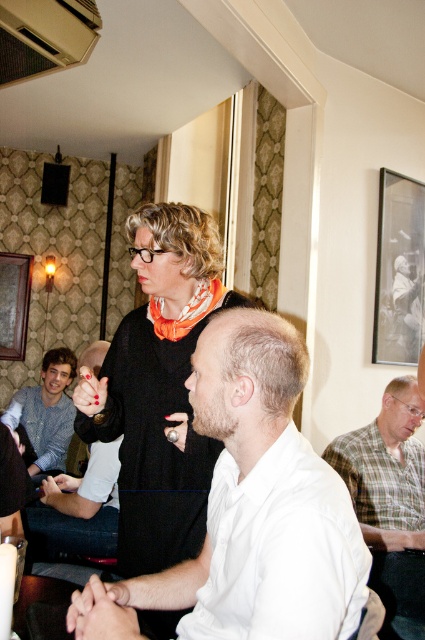
Question: Estimate the real-world distances between objects in this image. Which object is farther from the knitted sweater at left?

Choices:
 (A) white matte shirt at center
 (B) black matte picture frame at upper right
 (C) wooden picture frame at left
 (D) plaid shirt at center

Answer: (A)

Question: Estimate the real-world distances between objects in this image. Which object is farther from the white matte shirt at center?

Choices:
 (A) plaid shirt at center
 (B) black matte picture frame at upper right
 (C) white shirt at center

Answer: (B)

Question: Can you confirm if white matte shirt at center is positioned above black matte picture frame at upper right?

Choices:
 (A) yes
 (B) no

Answer: (B)

Question: Is knitted sweater at left further to camera compared to wooden picture frame at left?

Choices:
 (A) yes
 (B) no

Answer: (B)

Question: Based on their relative distances, which object is farther from the plaid shirt at center?

Choices:
 (A) white matte shirt at center
 (B) knitted sweater at left
 (C) white shirt at center
 (D) black matte picture frame at upper right

Answer: (B)

Question: Can you confirm if plaid shirt at center is positioned to the left of knitted sweater at left?

Choices:
 (A) no
 (B) yes

Answer: (A)